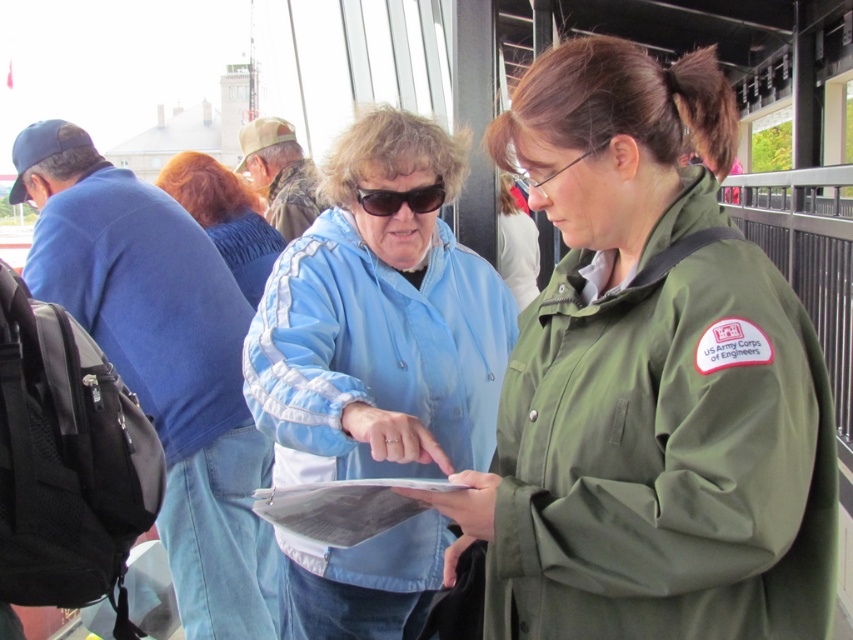
Question: Which point is closer to the camera?

Choices:
 (A) metallic gray clipboard at center
 (B) black metal rail at upper right
 (C) light blue fabric at center

Answer: (A)

Question: Can you confirm if light blue fabric at center is positioned to the right of black plastic sunglasses at center?

Choices:
 (A) yes
 (B) no

Answer: (A)

Question: Does black metal rail at upper right appear on the left side of black plastic sunglasses at center?

Choices:
 (A) yes
 (B) no

Answer: (B)

Question: Does black metal rail at upper right appear over blue fabric jacket at upper center?

Choices:
 (A) no
 (B) yes

Answer: (A)

Question: Which of the following is the farthest from the observer?

Choices:
 (A) black plastic sunglasses at center
 (B) metallic gray clipboard at center
 (C) green matte jacket at center

Answer: (A)

Question: Which point is closer to the camera?

Choices:
 (A) metallic gray clipboard at center
 (B) blue fabric jacket at upper center
 (C) black plastic sunglasses at center
 (D) light blue fabric at center

Answer: (A)